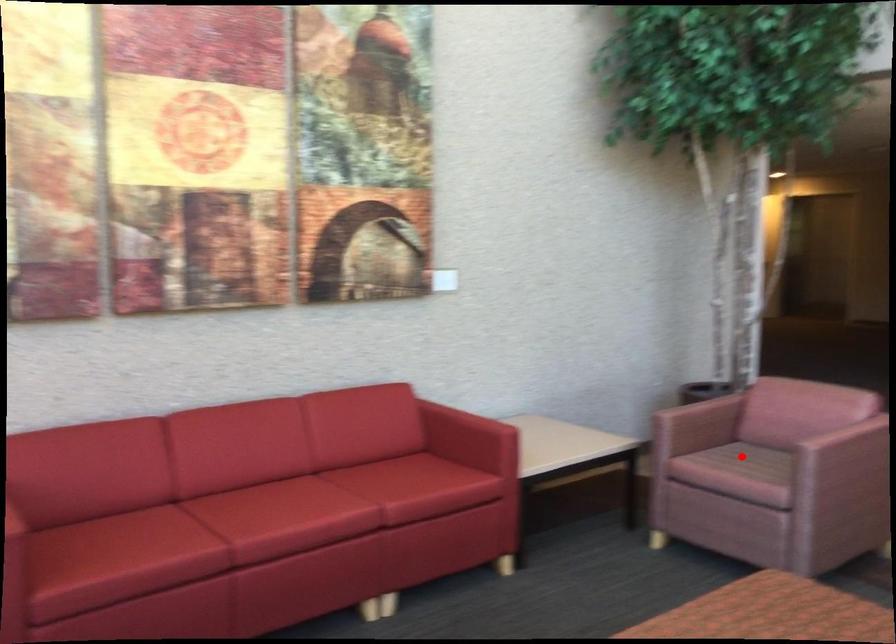
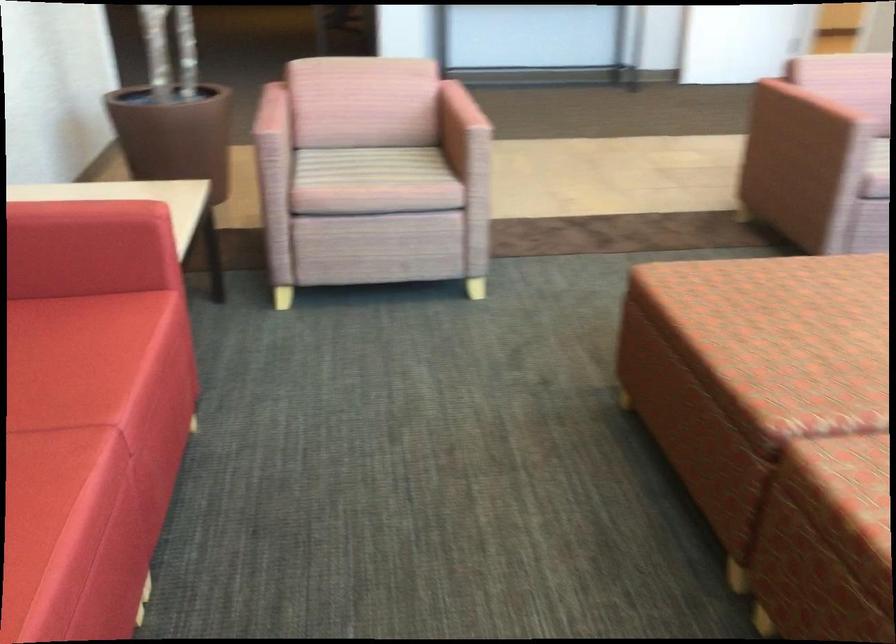
Question: I am providing you with two images of the same scene from different viewpoints. Image1 has a red point marked. In image2, the corresponding 3D location appears at what relative position? Reply with the corresponding letter.

Choices:
 (A) Closer
 (B) Farther

Answer: (A)